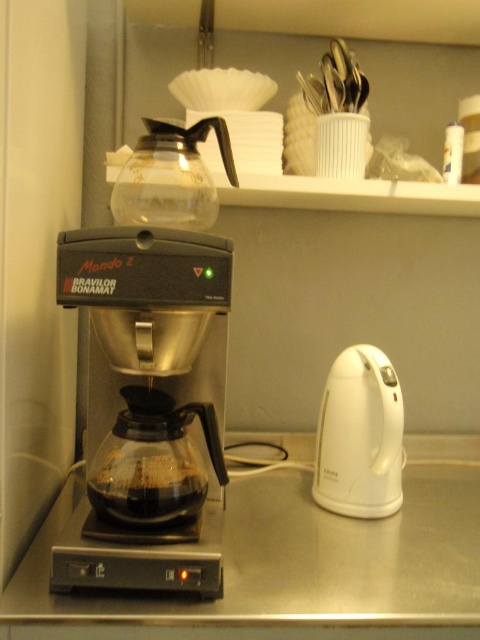
Is black plastic coffee machine at center to the left of white plastic electric kettle at right from the viewer's perspective?

Yes, black plastic coffee machine at center is to the left of white plastic electric kettle at right.

Is point (218, 499) closer to viewer compared to point (315, 458)?

Yes, it is in front of point (315, 458).

The width and height of the screenshot is (480, 640). I want to click on black plastic coffee machine at center, so click(x=149, y=403).

Between stainless steel counter at center and white plastic electric kettle at right, which one has less height?

stainless steel counter at center is shorter.

Where is `stainless steel counter at center`? The width and height of the screenshot is (480, 640). stainless steel counter at center is located at coordinates pos(299,563).

Is stainless steel counter at center to the right of black plastic coffee machine at center from the viewer's perspective?

Indeed, stainless steel counter at center is positioned on the right side of black plastic coffee machine at center.

Who is taller, stainless steel counter at center or black plastic coffee machine at center?

Standing taller between the two is black plastic coffee machine at center.

Does point (106, 632) come in front of point (164, 564)?

Yes, it is in front of point (164, 564).

This screenshot has height=640, width=480. I want to click on stainless steel counter at center, so click(299, 563).